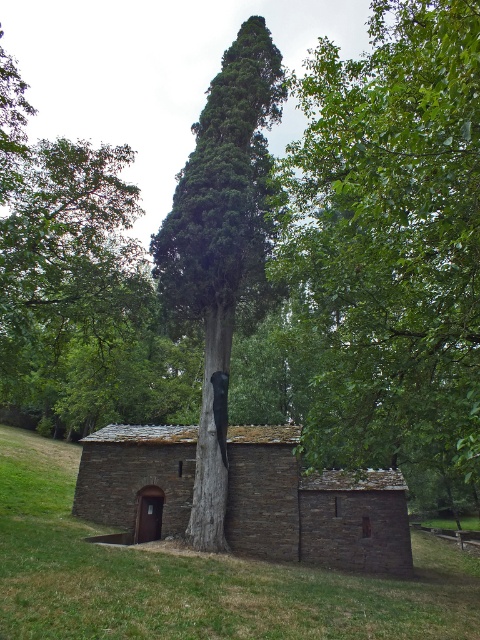
You are an architect assessing the structural integrity of the green leafy tree at center and the green textured tree at center within the stone building. Which tree has a larger physical presence in the building?

The green leafy tree at center has a larger physical presence in the building compared to the green textured tree at center, as it is bigger in size according to the description.

You are an architect examining the structure of the chapel and the trees growing through it. Which of the two trees, the green leafy tree at center or the green textured tree at center, is positioned higher up in the structure?

The green leafy tree at center is located above the green textured tree at center, so it is positioned higher up in the structure.